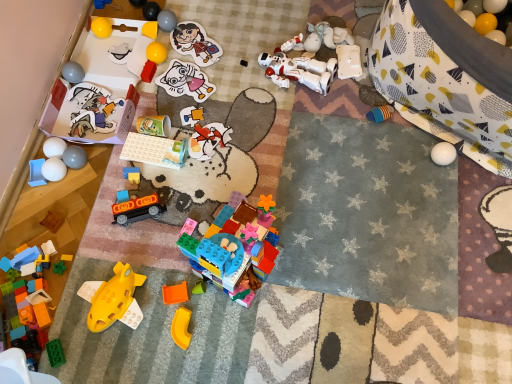
Identify the location of free area in between matte paper sticker at center, the nineteenth toy when ordered from left to right, and white plastic remote control at upper center, which is the second toy from right to left. The width and height of the screenshot is (512, 384). (246, 83).